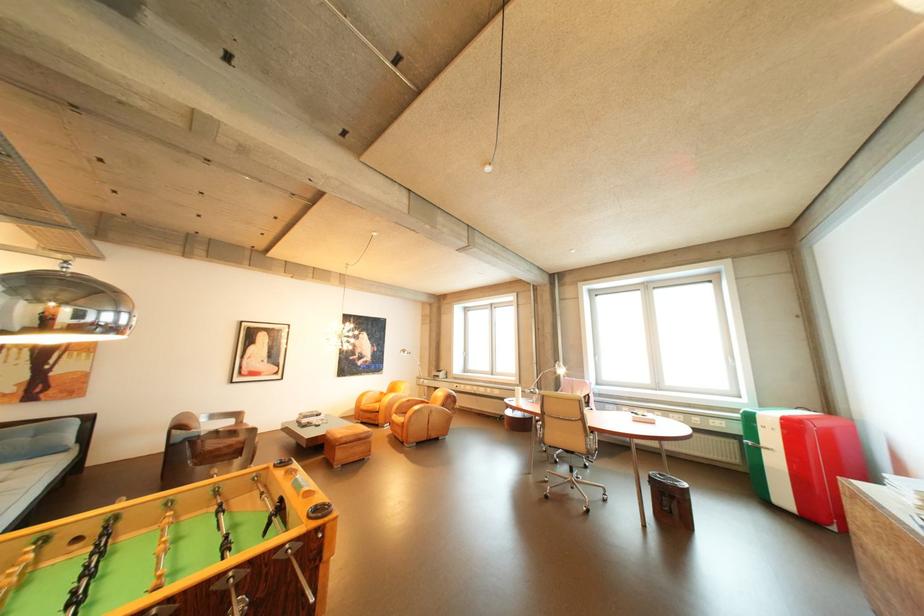
The width and height of the screenshot is (924, 616). Identify the location of briefcase handle. (757, 446).